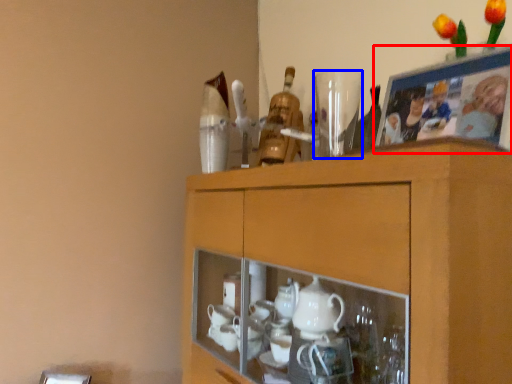
Question: Which object appears farthest to the camera in this image, picture frame (highlighted by a red box) or tableware (highlighted by a blue box)?

Choices:
 (A) picture frame
 (B) tableware

Answer: (B)